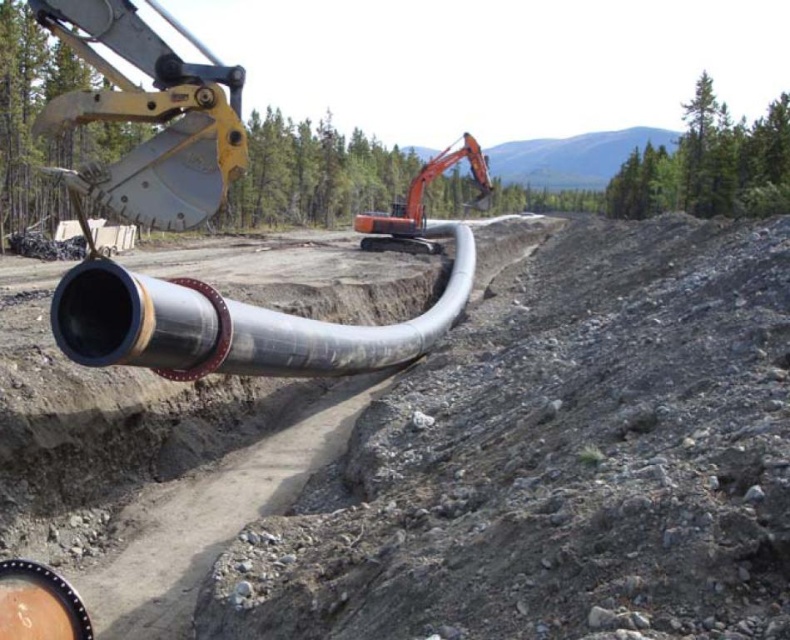
You are a surveyor standing at the construction site. You need to determine which of the two points, point (641,620) or point (175,317), is nearer to you. Can you identify the closer point based on the scene?

Point (641,620) is closer to the viewer than point (175,317), so the closer point is point (641,620).